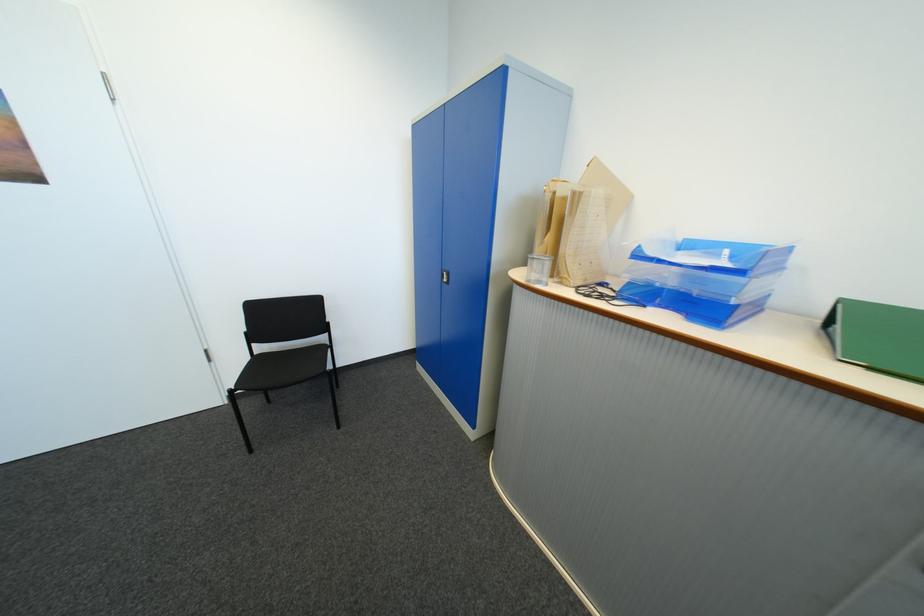
Describe the element at coordinates (444, 276) in the screenshot. This screenshot has width=924, height=616. I see `the black cabinet handle` at that location.